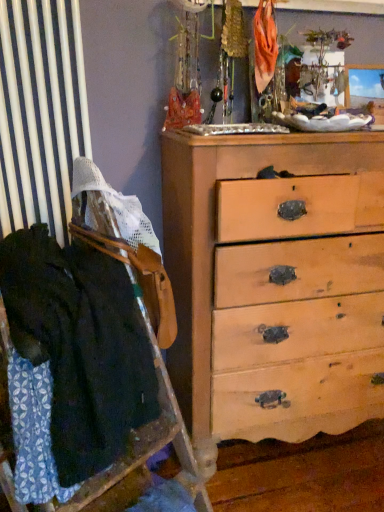
Where is `dark blue fabric at left`? The height and width of the screenshot is (512, 384). dark blue fabric at left is located at coordinates (74, 356).

Image resolution: width=384 pixels, height=512 pixels. What do you see at coordinates (74, 356) in the screenshot?
I see `dark blue fabric at left` at bounding box center [74, 356].

This screenshot has width=384, height=512. Describe the element at coordinates (275, 284) in the screenshot. I see `light brown wooden chest of drawers at center` at that location.

The height and width of the screenshot is (512, 384). I want to click on light brown wooden chest of drawers at center, so click(x=275, y=284).

Where is `dark blue fabric at left`? dark blue fabric at left is located at coordinates (74, 356).

Which object is positioned more to the right, light brown wooden chest of drawers at center or dark blue fabric at left?

light brown wooden chest of drawers at center is more to the right.

Which object is further away from the camera taking this photo, light brown wooden chest of drawers at center or dark blue fabric at left?

light brown wooden chest of drawers at center.

Considering the points (381, 210) and (22, 422), which point is in front, point (381, 210) or point (22, 422)?

The point (22, 422) is in front.

From the image's perspective, is light brown wooden chest of drawers at center positioned above or below dark blue fabric at left?

Based on their image positions, light brown wooden chest of drawers at center is located above dark blue fabric at left.

From a real-world perspective, between light brown wooden chest of drawers at center and dark blue fabric at left, who is vertically higher?

In real-world perspective, dark blue fabric at left is above.

Considering the sizes of objects light brown wooden chest of drawers at center and dark blue fabric at left in the image provided, who is thinner, light brown wooden chest of drawers at center or dark blue fabric at left?

dark blue fabric at left.

Considering the sizes of objects light brown wooden chest of drawers at center and dark blue fabric at left in the image provided, who is taller, light brown wooden chest of drawers at center or dark blue fabric at left?

With more height is light brown wooden chest of drawers at center.

From the picture: Which of these two, light brown wooden chest of drawers at center or dark blue fabric at left, is smaller?

Result: dark blue fabric at left is smaller.

Is light brown wooden chest of drawers at center located outside dark blue fabric at left?

Absolutely, light brown wooden chest of drawers at center is external to dark blue fabric at left.

Are light brown wooden chest of drawers at center and dark blue fabric at left far apart?

No, light brown wooden chest of drawers at center is in close proximity to dark blue fabric at left.

Does light brown wooden chest of drawers at center turn towards dark blue fabric at left?

No.

How many degrees apart are the facing directions of light brown wooden chest of drawers at center and dark blue fabric at left?

They differ by 27.7 degrees in their facing directions.

How distant is light brown wooden chest of drawers at center from dark blue fabric at left?

light brown wooden chest of drawers at center and dark blue fabric at left are 53.49 centimeters apart from each other.

What are the coordinates of `clothing that appears on the left of light brown wooden chest of drawers at center` in the screenshot? It's located at [74, 356].

Between dark blue fabric at left and light brown wooden chest of drawers at center, which one appears on the left side from the viewer's perspective?

Positioned to the left is dark blue fabric at left.

Which object is further away from the camera, dark blue fabric at left or light brown wooden chest of drawers at center?

light brown wooden chest of drawers at center is further away from the camera.

Does point (67, 358) lie in front of point (211, 341)?

Yes, it is in front of point (211, 341).

From the image's perspective, which is below, dark blue fabric at left or light brown wooden chest of drawers at center?

dark blue fabric at left is shown below in the image.

From a real-world perspective, is dark blue fabric at left physically located above or below light brown wooden chest of drawers at center?

dark blue fabric at left is situated higher than light brown wooden chest of drawers at center in the real world.

In the scene shown: Can you confirm if dark blue fabric at left is wider than light brown wooden chest of drawers at center?

No, dark blue fabric at left is not wider than light brown wooden chest of drawers at center.

Considering the relative sizes of dark blue fabric at left and light brown wooden chest of drawers at center in the image provided, is dark blue fabric at left shorter than light brown wooden chest of drawers at center?

Yes, dark blue fabric at left is shorter than light brown wooden chest of drawers at center.

Does dark blue fabric at left have a larger size compared to light brown wooden chest of drawers at center?

Incorrect, dark blue fabric at left is not larger than light brown wooden chest of drawers at center.

Is light brown wooden chest of drawers at center completely or partially inside dark blue fabric at left?

Definitely not — light brown wooden chest of drawers at center is not inside dark blue fabric at left.

From the picture: Is dark blue fabric at left beside light brown wooden chest of drawers at center?

dark blue fabric at left and light brown wooden chest of drawers at center are clearly separated.

Is dark blue fabric at left facing away from light brown wooden chest of drawers at center?

That's not correct — dark blue fabric at left is not looking away from light brown wooden chest of drawers at center.

Identify the location of clothing below the light brown wooden chest of drawers at center (from the image's perspective). (74, 356).

Image resolution: width=384 pixels, height=512 pixels. Identify the location of chest of drawers on the right side of dark blue fabric at left. (275, 284).

The width and height of the screenshot is (384, 512). What are the coordinates of `clothing located in front of the light brown wooden chest of drawers at center` in the screenshot? It's located at (74, 356).